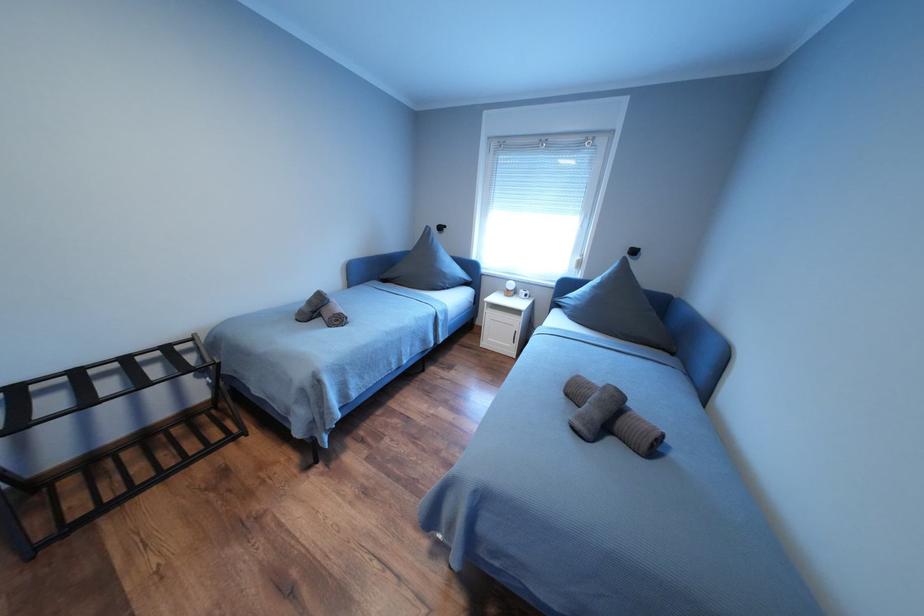
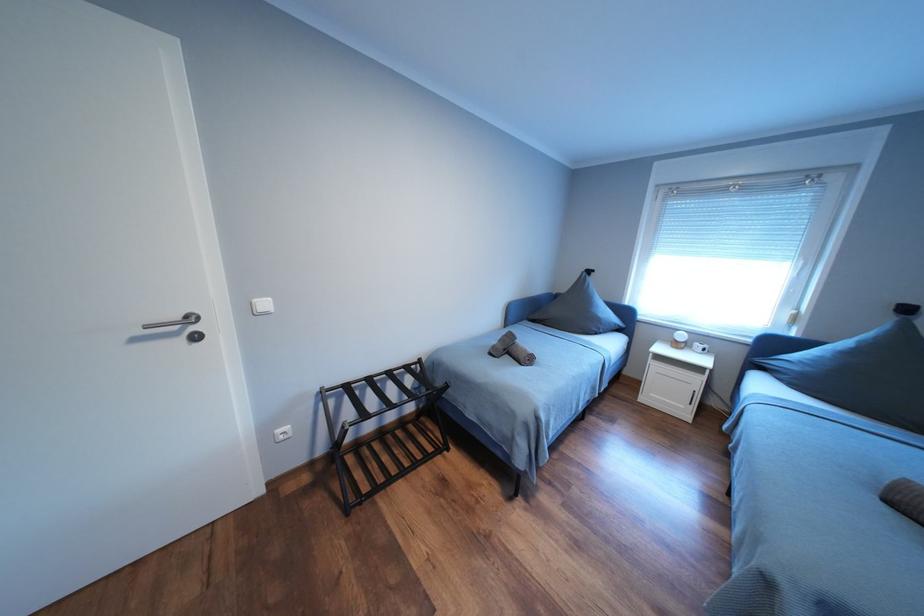
Which direction would the cameraman need to move to produce the second image?

The movement direction of the cameraman is left, backward.